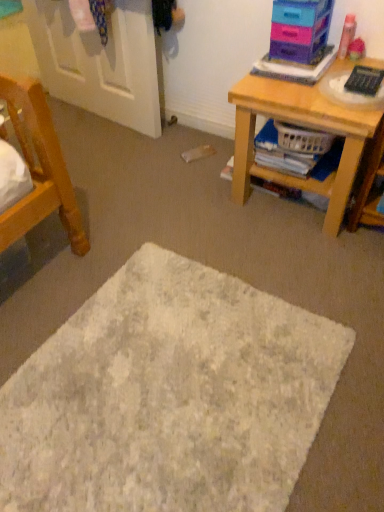
The height and width of the screenshot is (512, 384). Identify the location of free point below white textured mat at center (from a real-world perspective). (155, 420).